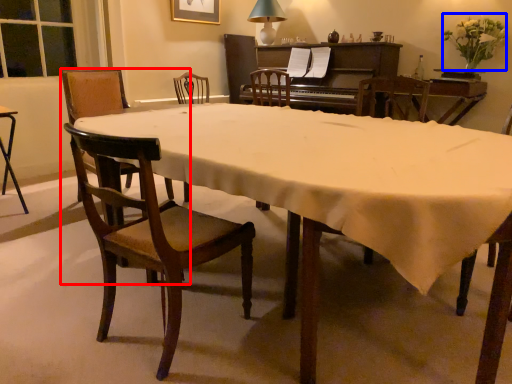
Question: Among these objects, which one is farthest to the camera, chair (highlighted by a red box) or flower (highlighted by a blue box)?

Choices:
 (A) chair
 (B) flower

Answer: (B)